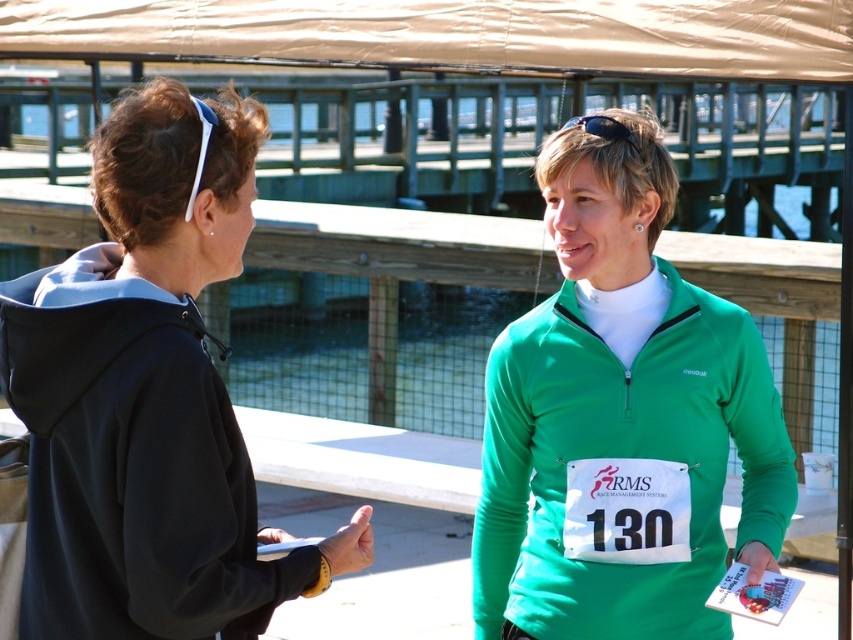
Question: Does matte black hoodie at left appear over green zip-up sweater at center?

Choices:
 (A) no
 (B) yes

Answer: (B)

Question: Does matte black hoodie at left have a larger size compared to green zip-up sweater at center?

Choices:
 (A) yes
 (B) no

Answer: (A)

Question: Which object appears closest to the camera in this image?

Choices:
 (A) matte black hoodie at left
 (B) green zip-up sweater at center

Answer: (A)

Question: Is the position of matte black hoodie at left less distant than that of green zip-up sweater at center?

Choices:
 (A) yes
 (B) no

Answer: (A)

Question: Which point is closer to the camera?

Choices:
 (A) (634, 230)
 (B) (347, 564)

Answer: (B)